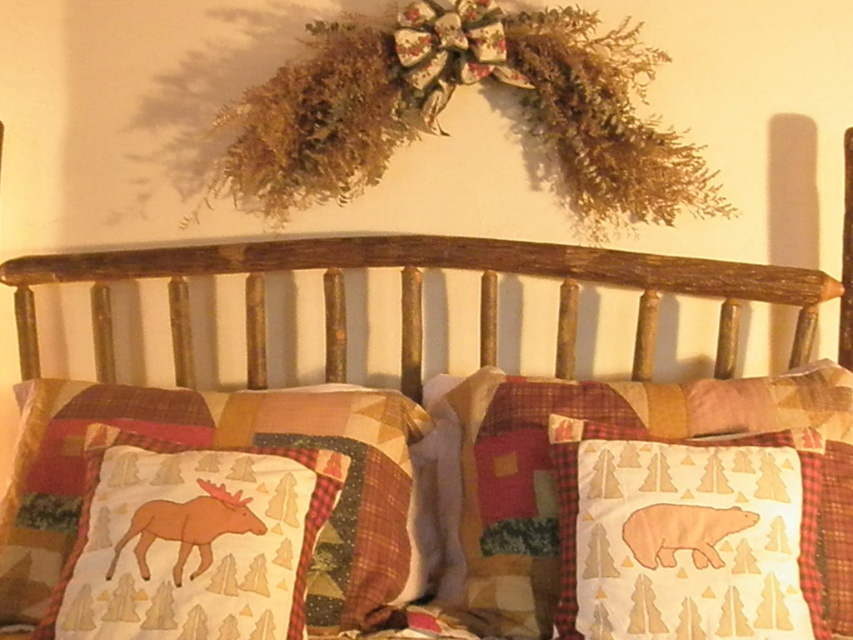
You are standing in the bedroom and want to hang a picture frame that is 1.5 meters wide. The frame needs to be placed exactly where the rustic wood headboard at center is currently located. Is there enough space between you and the headboard to safely hang the frame without moving closer or farther away?

The distance between you and the rustic wood headboard at center is 1.69 meters. Since the picture frame is 1.5 meters wide, which is narrower than the available space, you have enough room to hang it without needing to adjust your position.

You are arranging a cozy rustic bedroom scene. You have two pillows on the bed, a patchwork fabric pillow with moose design at center and a white cotton bear at center. Which pillow is shorter in height?

The patchwork fabric pillow with moose design at center is not as tall as the white cotton bear at center, so the patchwork fabric pillow with moose design at center is shorter in height.

You are organizing a small display on a shelf and have both the rustic wood headboard at center and the white cotton bear at center. If you want to arrange them side by side without overlapping, which object should you place first to ensure they both fit?

The rustic wood headboard at center is wider than the white cotton bear at center. Therefore, you should place the rustic wood headboard at center first to accommodate its larger width, then position the white cotton bear at center next to it.